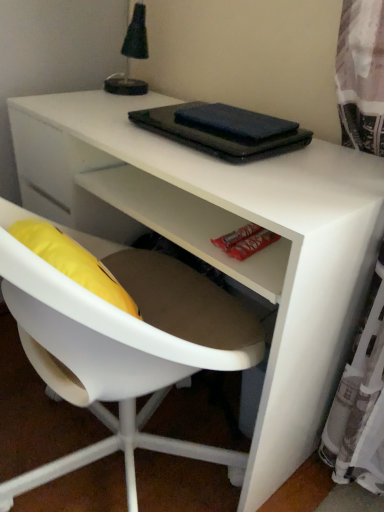
Find the location of a particular element. Image resolution: width=384 pixels, height=512 pixels. vacant space situated above black matte notebook at center, the 2th notebook positioned from the top (from a real-world perspective) is located at coordinates (208, 123).